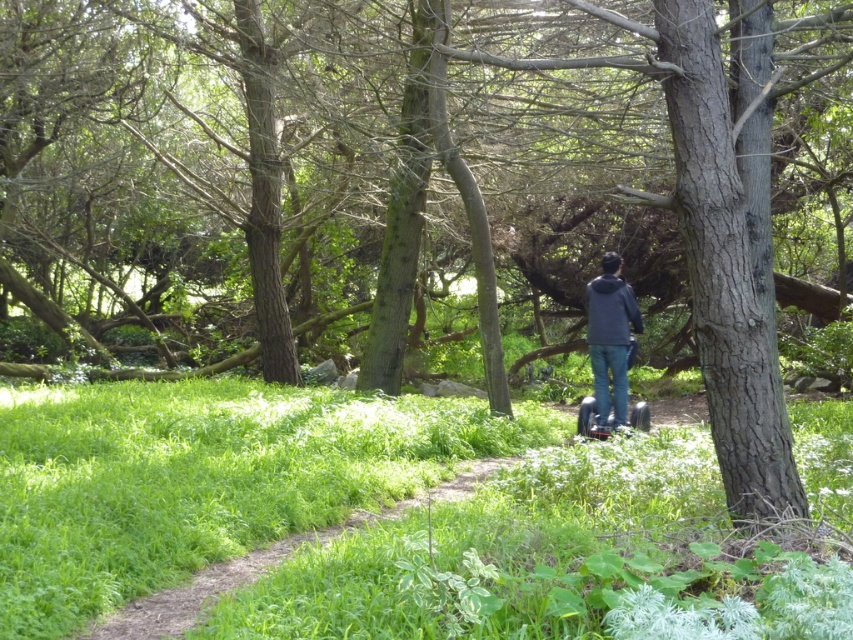
Question: Is green grass at center to the left of dark gray hoodie at center from the viewer's perspective?

Choices:
 (A) no
 (B) yes

Answer: (B)

Question: Which is nearer to the green grass at center?

Choices:
 (A) metallic silver scooter at center
 (B) dark gray hoodie at center

Answer: (A)

Question: Which object is farther from the camera taking this photo?

Choices:
 (A) dark gray hoodie at center
 (B) green grass at center
 (C) metallic silver scooter at center

Answer: (A)

Question: Which object is farther from the camera taking this photo?

Choices:
 (A) metallic silver scooter at center
 (B) dark gray hoodie at center

Answer: (B)

Question: Does dark gray hoodie at center appear on the right side of metallic silver scooter at center?

Choices:
 (A) yes
 (B) no

Answer: (A)

Question: Does green grass at center have a larger size compared to dark gray hoodie at center?

Choices:
 (A) no
 (B) yes

Answer: (B)